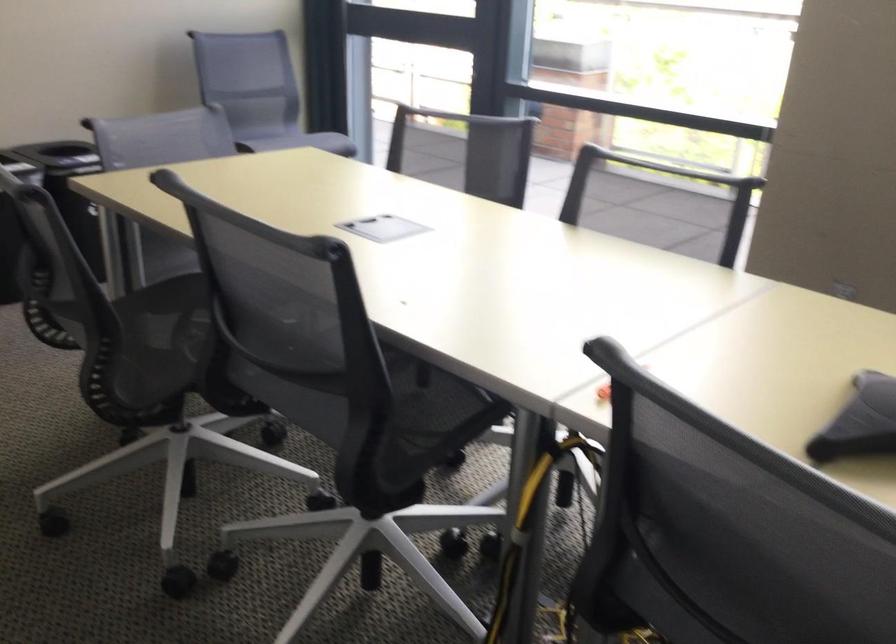
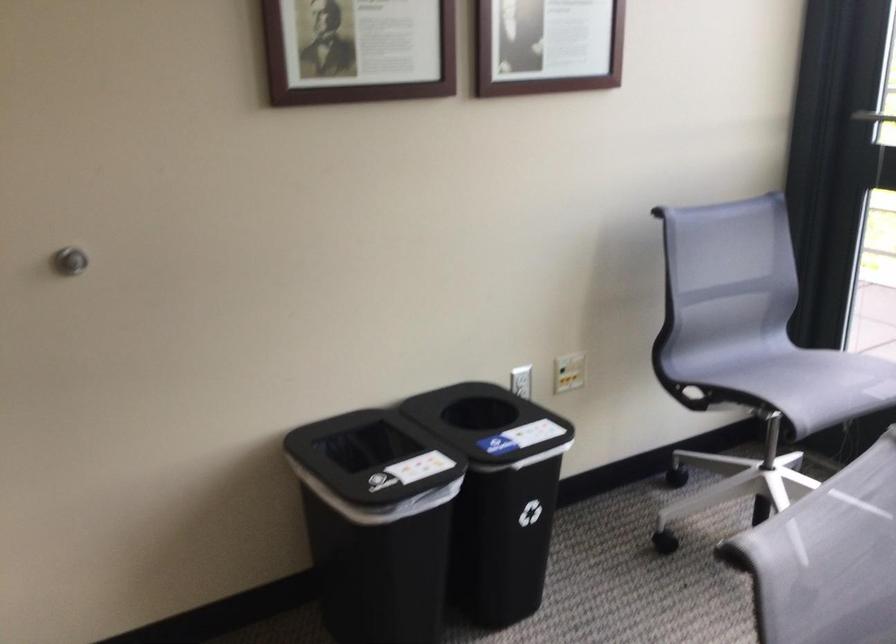
Where in the second image is the point corresponding to point 287,140 from the first image?

(812, 382)